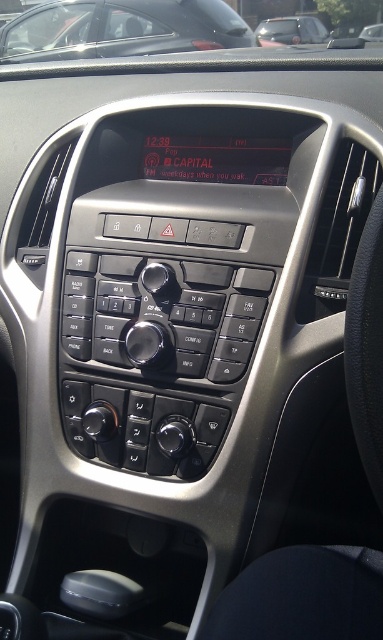
Question: Among these objects, which one is farthest from the camera?

Choices:
 (A) metallic gray car at upper center
 (B) metallic silver car at upper center

Answer: (B)

Question: Is metallic gray car at upper center positioned before metallic silver car at upper center?

Choices:
 (A) no
 (B) yes

Answer: (B)

Question: Among these points, which one is farthest from the camera?

Choices:
 (A) click(x=273, y=26)
 (B) click(x=150, y=26)

Answer: (A)

Question: Does metallic gray car at upper center have a larger size compared to metallic silver car at upper center?

Choices:
 (A) yes
 (B) no

Answer: (A)

Question: Does metallic gray car at upper center appear over metallic silver car at upper center?

Choices:
 (A) no
 (B) yes

Answer: (A)